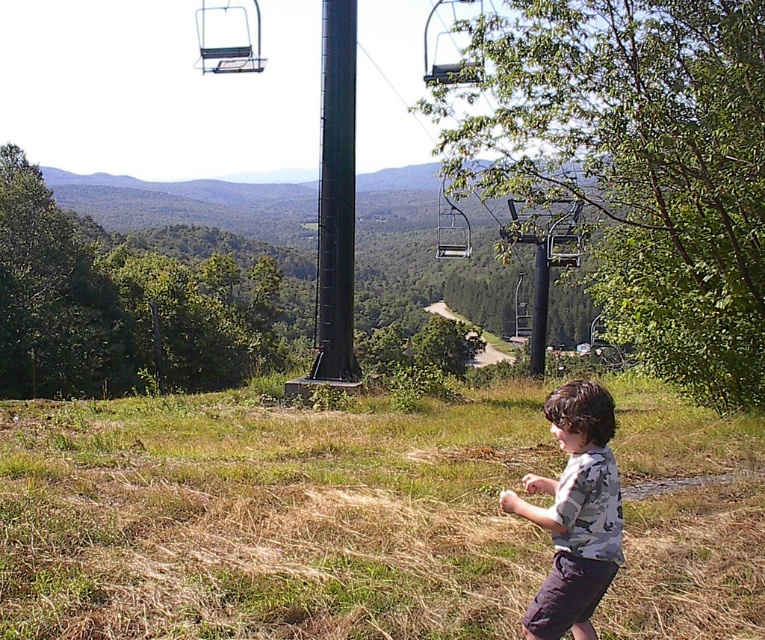
You are a photographer trying to capture a photo of the metallic silver ski lift at center while also including the camouflage shirt at lower right in the frame. Based on their sizes, which object should you focus on first to ensure both are in the shot?

The camouflage shirt at lower right occupies less space than the metallic silver ski lift at center, so you should focus on the metallic silver ski lift at center first to ensure both are in the shot.

You are a maintenance worker at the ski resort and need to inspect the metallic pole at center and the metallic gray ski lift at upper center. The safety regulations state that the distance between these two structures must be at least 20 meters for proper operation. Based on the scene, can you confirm if the current distance meets the requirement?

The distance between the metallic pole at center and the metallic gray ski lift at upper center is 22.72 meters, which exceeds the required 20 meters. Therefore, the current distance meets the safety regulations.